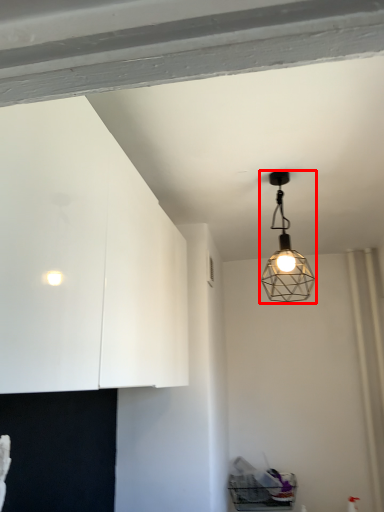
Question: Where is lamp (annotated by the red box) located in relation to dresser in the image?

Choices:
 (A) right
 (B) left

Answer: (A)